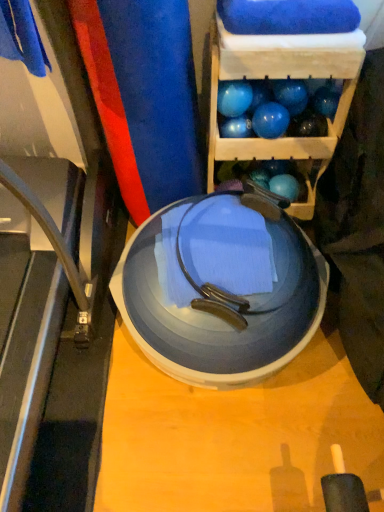
What do you see at coordinates (204, 371) in the screenshot?
I see `transparent plastic plate at center` at bounding box center [204, 371].

How much space does blue rubber ball at upper right, the first ball when ordered from left to right, occupy vertically?

blue rubber ball at upper right, the first ball when ordered from left to right, is 4.78 inches in height.

The image size is (384, 512). Describe the element at coordinates (326, 101) in the screenshot. I see `blue rubber balloon at upper right` at that location.

The image size is (384, 512). What are the coordinates of `metallic gray treadmill at lower left` in the screenshot? It's located at (53, 282).

This screenshot has width=384, height=512. I want to click on glossy blue ball at upper center, acting as the second ball starting from the left, so tap(236, 127).

Identify the location of blue rubber ball at upper center, which is the 2th ball from right to left. (270, 120).

The height and width of the screenshot is (512, 384). What do you see at coordinates (283, 78) in the screenshot?
I see `blue glossy bowling balls at upper right` at bounding box center [283, 78].

The width and height of the screenshot is (384, 512). I want to click on transparent plastic plate at center, so click(x=204, y=371).

Which is closer to the camera, (x=150, y=359) or (x=320, y=101)?

The point (x=150, y=359) is closer.

Is transparent plastic plate at center shorter than blue rubber balloon at upper right?

Incorrect, the height of transparent plastic plate at center does not fall short of that of blue rubber balloon at upper right.

How many degrees apart are the facing directions of transparent plastic plate at center and blue rubber balloon at upper right?

They differ by 1.03 degrees in their facing directions.

Considering the relative positions of transparent plastic plate at center and blue rubber balloon at upper right in the image provided, is transparent plastic plate at center to the left or to the right of blue rubber balloon at upper right?

In the image, transparent plastic plate at center appears on the left side of blue rubber balloon at upper right.

Based on the photo, how distant is blue rubber ball at upper right, which is the 4th ball from right to left, from transparent plastic plate at center?

blue rubber ball at upper right, which is the 4th ball from right to left, and transparent plastic plate at center are 24.90 inches apart from each other.

Looking at this image, is blue rubber ball at upper right, the first ball when ordered from left to right, bigger than transparent plastic plate at center?

No, blue rubber ball at upper right, the first ball when ordered from left to right, is not bigger than transparent plastic plate at center.

Consider the image. Which is closer, (x=226, y=106) or (x=316, y=321)?

Point (x=226, y=106).

From a real-world perspective, is blue rubber ball at upper right, the first ball when ordered from left to right, positioned over transparent plastic plate at center based on gravity?

Yes, from a real-world perspective, blue rubber ball at upper right, the first ball when ordered from left to right, is above transparent plastic plate at center.

Where is `shelf below the blue rubber ball at upper right, the fourth ball from the left (from the image's perspective)`? shelf below the blue rubber ball at upper right, the fourth ball from the left (from the image's perspective) is located at coordinates (283, 78).

Does blue rubber ball at upper right, which appears as the 1th ball when viewed from the right, have a greater width compared to blue glossy bowling balls at upper right?

In fact, blue rubber ball at upper right, which appears as the 1th ball when viewed from the right, might be narrower than blue glossy bowling balls at upper right.

From the image's perspective, between blue rubber ball at upper right, which appears as the 1th ball when viewed from the right, and blue glossy bowling balls at upper right, which one is located above?

blue rubber ball at upper right, which appears as the 1th ball when viewed from the right, appears higher in the image.

Image resolution: width=384 pixels, height=512 pixels. I want to click on the 2nd ball to the right when counting from the transparent plastic plate at center, so click(236, 127).

Between transparent plastic plate at center and glossy blue ball at upper center, acting as the second ball starting from the left, which one is positioned in front?

Positioned in front is transparent plastic plate at center.

Is point (143, 348) in front of point (245, 121)?

Yes.

Based on the photo, who is shorter, transparent plastic plate at center or glossy blue ball at upper center, positioned as the third ball in right-to-left order?

Standing shorter between the two is glossy blue ball at upper center, positioned as the third ball in right-to-left order.

Does metallic gray treadmill at lower left contain blue rubber balloon at upper right?

That's incorrect, blue rubber balloon at upper right is not inside metallic gray treadmill at lower left.

Is metallic gray treadmill at lower left wider or thinner than blue rubber balloon at upper right?

Considering their sizes, metallic gray treadmill at lower left looks broader than blue rubber balloon at upper right.

Consider the image. Is metallic gray treadmill at lower left at the right side of blue rubber balloon at upper right?

Incorrect, metallic gray treadmill at lower left is not on the right side of blue rubber balloon at upper right.

Does metallic gray treadmill at lower left touch blue rubber balloon at upper right?

No, metallic gray treadmill at lower left is not in contact with blue rubber balloon at upper right.

Relative to blue rubber ball at upper right, which is the 4th ball from right to left, is metallic gray treadmill at lower left in front or behind?

In the image, metallic gray treadmill at lower left appears in front of blue rubber ball at upper right, which is the 4th ball from right to left.

Between metallic gray treadmill at lower left and blue rubber ball at upper right, the first ball when ordered from left to right, which one appears on the right side from the viewer's perspective?

Positioned to the right is blue rubber ball at upper right, the first ball when ordered from left to right.

Can we say metallic gray treadmill at lower left lies outside blue rubber ball at upper right, which is the 4th ball from right to left?

Yes, metallic gray treadmill at lower left is located beyond the bounds of blue rubber ball at upper right, which is the 4th ball from right to left.

Measure the distance between metallic gray treadmill at lower left and blue rubber ball at upper right, which is the 4th ball from right to left.

A distance of 28.29 inches exists between metallic gray treadmill at lower left and blue rubber ball at upper right, which is the 4th ball from right to left.

Who is bigger, blue rubber balloon at upper right or glossy blue ball at upper center, acting as the second ball starting from the left?

With larger size is blue rubber balloon at upper right.

Is blue rubber balloon at upper right far away from glossy blue ball at upper center, acting as the second ball starting from the left?

No, there isn't a large distance between blue rubber balloon at upper right and glossy blue ball at upper center, acting as the second ball starting from the left.

Which is in front, point (325, 110) or point (248, 125)?

The point (325, 110) is closer.

Considering the positions of objects blue rubber balloon at upper right and glossy blue ball at upper center, positioned as the third ball in right-to-left order, in the image provided, who is in front, blue rubber balloon at upper right or glossy blue ball at upper center, positioned as the third ball in right-to-left order,?

glossy blue ball at upper center, positioned as the third ball in right-to-left order, is closer to the camera.

Find the location of a particular element. Image resolution: width=384 pixels, height=512 pixels. plate in front of the blue rubber balloon at upper right is located at coordinates (204, 371).

There is a transparent plastic plate at center. Identify the location of the 3rd ball above it (from a real-world perspective). (234, 98).

Estimate the real-world distances between objects in this image. Which object is further from blue glossy bowling balls at upper right, blue rubber ball at upper center, which is the 2th ball from right to left, or blue rubber balloon at upper right?

blue rubber balloon at upper right is positioned further to the anchor blue glossy bowling balls at upper right.

Consider the image. Which object lies further to the anchor point blue rubber ball at upper right, which appears as the 1th ball when viewed from the right, glossy blue ball at upper center, acting as the second ball starting from the left, or blue rubber ball at upper right, which is the 4th ball from right to left?

glossy blue ball at upper center, acting as the second ball starting from the left, is positioned further to the anchor blue rubber ball at upper right, which appears as the 1th ball when viewed from the right.

Based on their spatial positions, is transparent plastic plate at center or metallic gray treadmill at lower left closer to blue rubber balloon at upper right?

The object closer to blue rubber balloon at upper right is transparent plastic plate at center.

When comparing their distances from transparent plastic plate at center, does blue rubber ball at upper center, which is counted as the third ball, starting from the left, or blue rubber ball at upper right, which is the 4th ball from right to left, seem further?

blue rubber ball at upper right, which is the 4th ball from right to left.

In the scene shown: Considering their positions, is blue rubber ball at upper center, which is the 2th ball from right to left, positioned closer to glossy blue ball at upper center, acting as the second ball starting from the left, than metallic gray treadmill at lower left?

blue rubber ball at upper center, which is the 2th ball from right to left, is closer to glossy blue ball at upper center, acting as the second ball starting from the left.

Considering their positions, is blue rubber ball at upper right, the fourth ball from the left, positioned further to blue rubber ball at upper right, which is the 4th ball from right to left, than blue glossy bowling balls at upper right?

blue glossy bowling balls at upper right is positioned further to the anchor blue rubber ball at upper right, which is the 4th ball from right to left.

From the image, which object appears to be nearer to metallic gray treadmill at lower left, blue glossy bowling balls at upper right or blue rubber balloon at upper right?

blue glossy bowling balls at upper right is positioned closer to the anchor metallic gray treadmill at lower left.

When comparing their distances from blue glossy bowling balls at upper right, does blue rubber balloon at upper right or blue rubber ball at upper center, which is the 2th ball from right to left, seem further?

Among the two, blue rubber balloon at upper right is located further to blue glossy bowling balls at upper right.

Image resolution: width=384 pixels, height=512 pixels. Find the location of `ball between glossy blue ball at upper center, acting as the second ball starting from the left, and blue rubber ball at upper right, the fourth ball from the left, from left to right`. ball between glossy blue ball at upper center, acting as the second ball starting from the left, and blue rubber ball at upper right, the fourth ball from the left, from left to right is located at coordinates (270, 120).

Image resolution: width=384 pixels, height=512 pixels. Find the location of `ball between blue rubber ball at upper right, the first ball when ordered from left to right, and blue rubber ball at upper center, which is counted as the third ball, starting from the left`. ball between blue rubber ball at upper right, the first ball when ordered from left to right, and blue rubber ball at upper center, which is counted as the third ball, starting from the left is located at coordinates (236, 127).

Where is `shelf between metallic gray treadmill at lower left and blue rubber ball at upper right, which appears as the 1th ball when viewed from the right, from left to right`? This screenshot has width=384, height=512. shelf between metallic gray treadmill at lower left and blue rubber ball at upper right, which appears as the 1th ball when viewed from the right, from left to right is located at coordinates (283, 78).

The image size is (384, 512). Find the location of `plate between metallic gray treadmill at lower left and blue glossy bowling balls at upper right from left to right`. plate between metallic gray treadmill at lower left and blue glossy bowling balls at upper right from left to right is located at coordinates (204, 371).